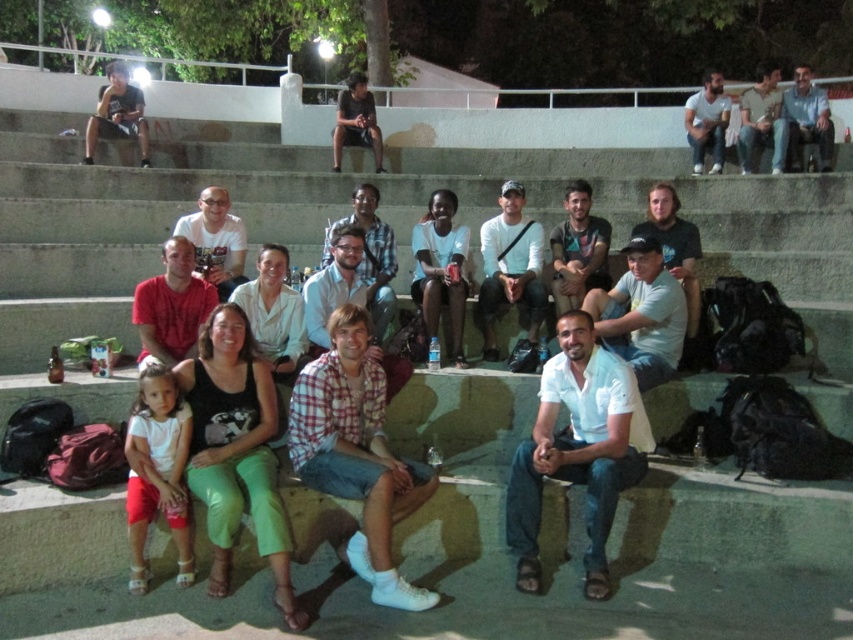
Question: Is matte white shirt at center above light blue jeans at upper right?

Choices:
 (A) yes
 (B) no

Answer: (B)

Question: Can you confirm if matte white shirt at center is smaller than light blue jeans at upper right?

Choices:
 (A) yes
 (B) no

Answer: (A)

Question: Which point is closer to the camera?

Choices:
 (A) light blue jeans at upper right
 (B) matte white shirt at center

Answer: (B)

Question: Which object is farther from the camera taking this photo?

Choices:
 (A) light blue jeans at upper right
 (B) matte white shirt at center

Answer: (A)

Question: Can you confirm if matte white shirt at center is bigger than light blue jeans at upper right?

Choices:
 (A) yes
 (B) no

Answer: (B)

Question: Which point is farther to the camera?

Choices:
 (A) (381, 435)
 (B) (767, 76)

Answer: (B)